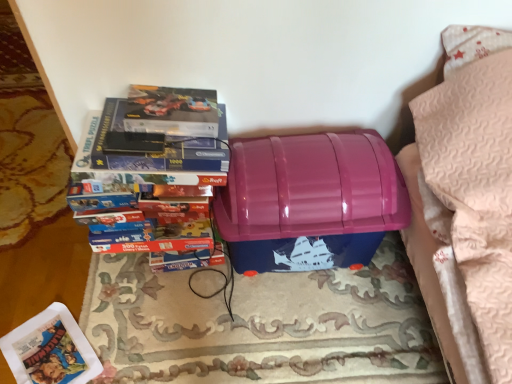
At what (x,y) coordinates should I click in order to perform the action: click on vacant space situated above matte plastic paperback book at lower left (from a real-world perspective). Please return your answer as a coordinate pair (x, y). Image resolution: width=512 pixels, height=384 pixels. Looking at the image, I should click on (54, 354).